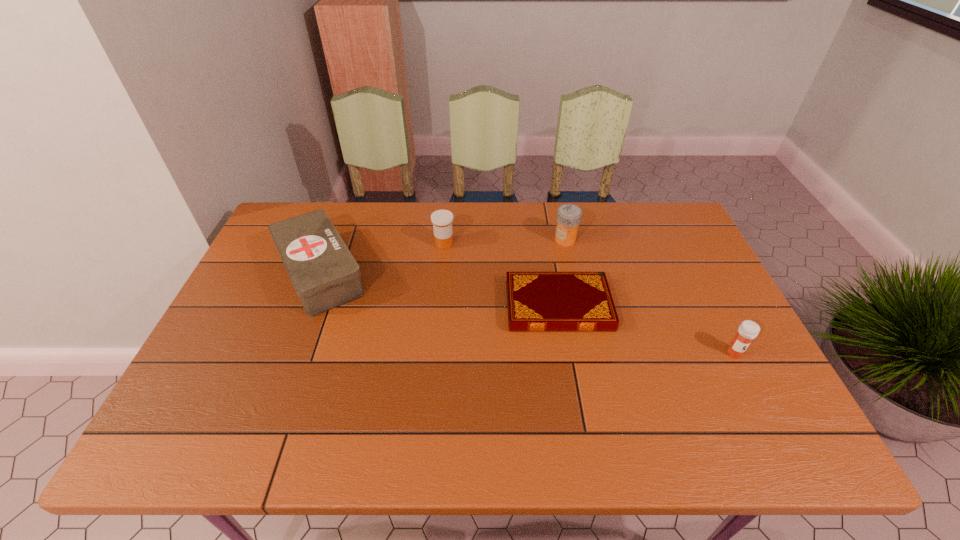
Identify the location of the second medicine from right to left. This screenshot has width=960, height=540. (569, 216).

I want to click on the leftmost medicine, so click(x=442, y=220).

Locate an element on the screen. the leftmost object is located at coordinates (325, 275).

The height and width of the screenshot is (540, 960). I want to click on the nearest medicine, so click(748, 330).

Locate an element on the screen. the rightmost medicine is located at coordinates (748, 330).

Where is `hardback book`? The width and height of the screenshot is (960, 540). hardback book is located at coordinates (536, 301).

Locate an element on the screen. vacant space located on the label side of the second medicine from left to right is located at coordinates (526, 240).

This screenshot has height=540, width=960. Identify the location of vacant space located on the label side of the second medicine from left to right. (464, 240).

The width and height of the screenshot is (960, 540). Identify the location of free space located 0.080m on the label side of the second medicine from left to right. (529, 240).

Locate an element on the screen. The width and height of the screenshot is (960, 540). vacant space situated on the label of the leftmost medicine is located at coordinates (521, 244).